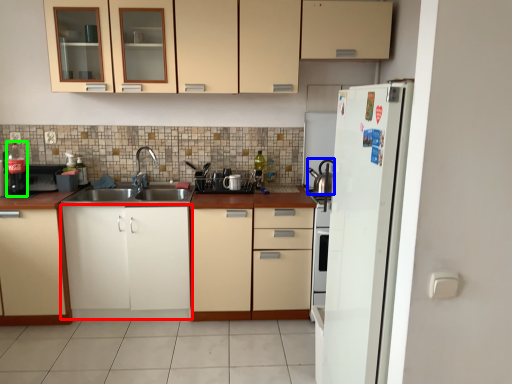
Question: Which is nearer to the cabinetry (highlighted by a red box)? tea pot (highlighted by a blue box) or bottle (highlighted by a green box).

Choices:
 (A) tea pot
 (B) bottle

Answer: (B)